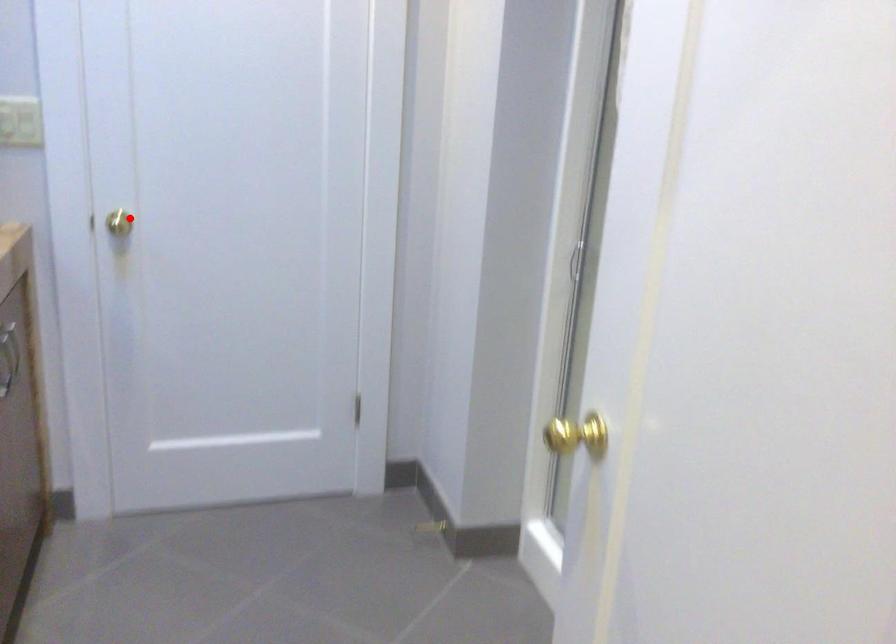
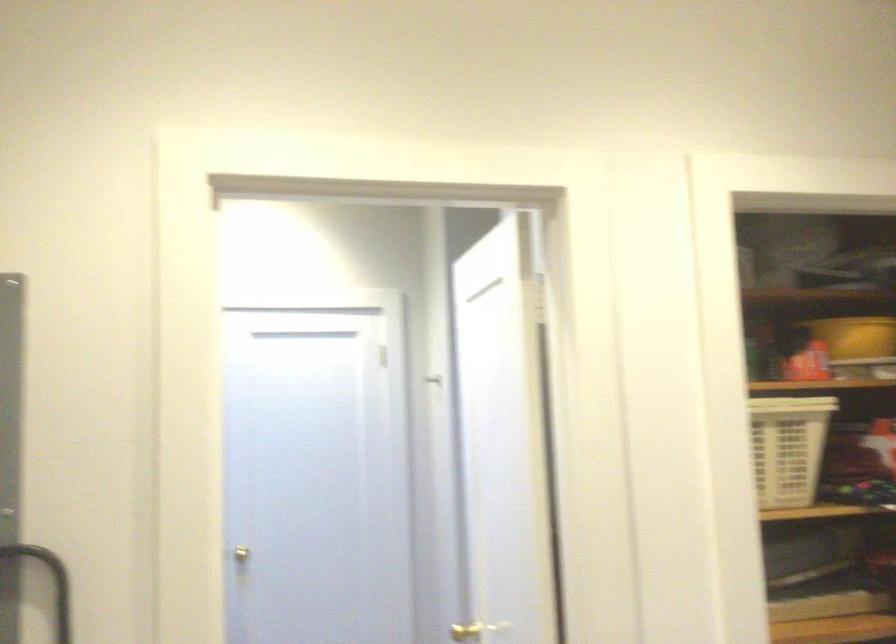
Locate, in the second image, the point that corresponds to the highlighted location in the first image.

(253, 553)